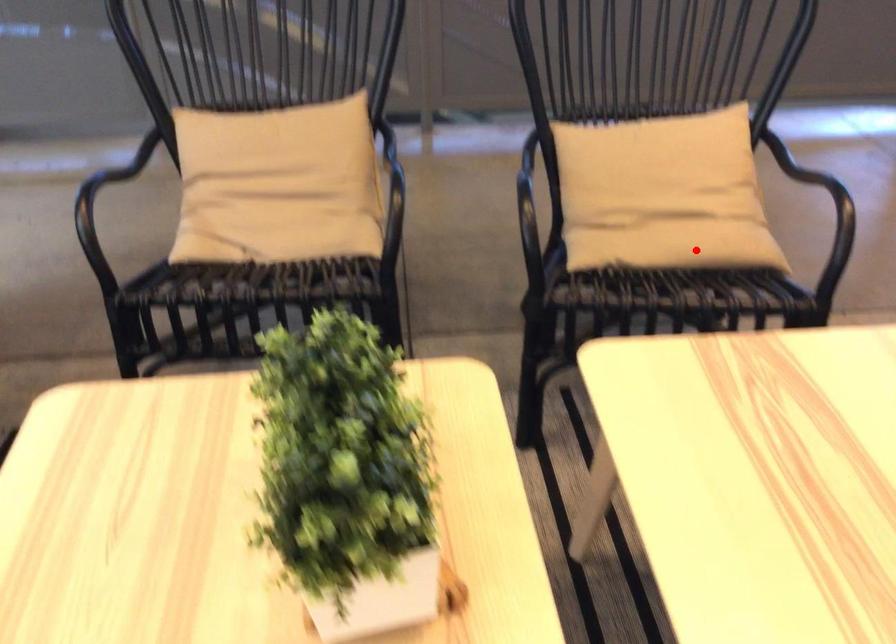
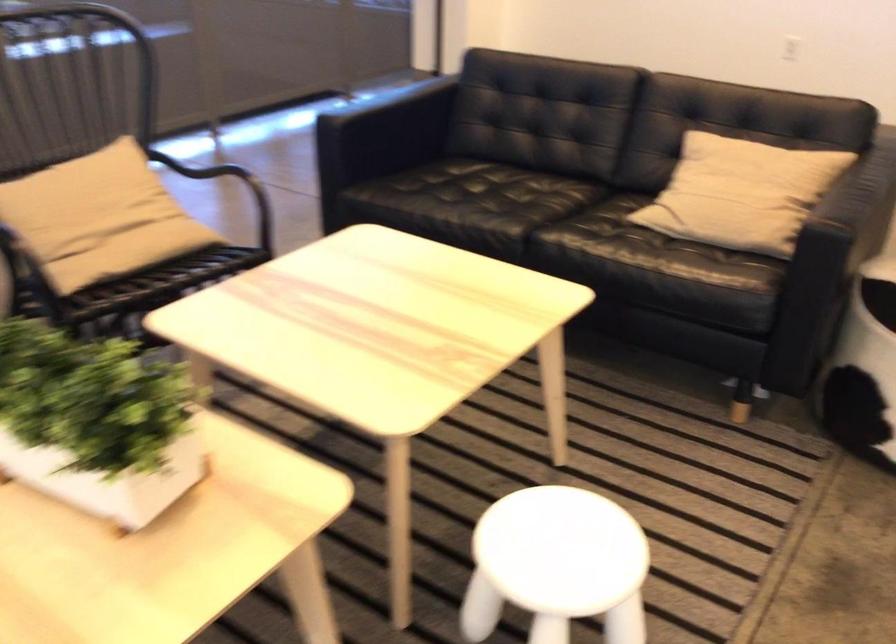
In the second image, find the point that corresponds to the highlighted location in the first image.

(151, 254)